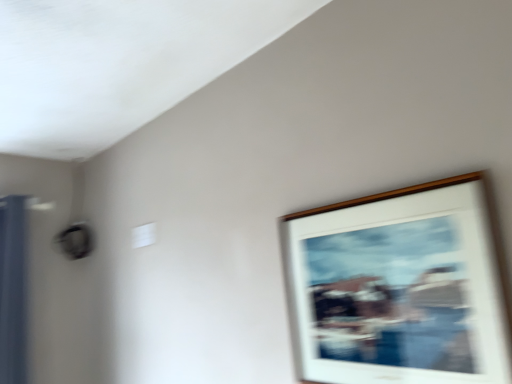
In order to click on white matte picture frame at upper right in this screenshot , I will do `click(400, 286)`.

Based on the photo, in order to face white matte picture frame at upper right, should I rotate leftwards or rightwards?

You should look right and rotate roughly 15.386 degrees.

The image size is (512, 384). Describe the element at coordinates (400, 286) in the screenshot. I see `white matte picture frame at upper right` at that location.

What do you see at coordinates (13, 289) in the screenshot? The image size is (512, 384). I see `blue fabric curtain at left` at bounding box center [13, 289].

Where is `blue fabric curtain at left`? The image size is (512, 384). blue fabric curtain at left is located at coordinates (13, 289).

I want to click on white matte picture frame at upper right, so click(400, 286).

Is blue fabric curtain at left at the left side of white matte picture frame at upper right?

Indeed, blue fabric curtain at left is positioned on the left side of white matte picture frame at upper right.

Which is behind, blue fabric curtain at left or white matte picture frame at upper right?

blue fabric curtain at left.

Considering the positions of point (17, 323) and point (371, 321), is point (17, 323) closer or farther from the camera than point (371, 321)?

Point (17, 323).

From the image's perspective, is blue fabric curtain at left positioned above or below white matte picture frame at upper right?

blue fabric curtain at left is below white matte picture frame at upper right.

From a real-world perspective, does blue fabric curtain at left sit lower than white matte picture frame at upper right?

No, from a real-world perspective, blue fabric curtain at left is not below white matte picture frame at upper right.

Considering the sizes of objects blue fabric curtain at left and white matte picture frame at upper right in the image provided, who is thinner, blue fabric curtain at left or white matte picture frame at upper right?

Thinner between the two is white matte picture frame at upper right.

Does blue fabric curtain at left have a greater height compared to white matte picture frame at upper right?

Yes, blue fabric curtain at left is taller than white matte picture frame at upper right.

Can you confirm if blue fabric curtain at left is bigger than white matte picture frame at upper right?

Yes, blue fabric curtain at left is bigger than white matte picture frame at upper right.

Is white matte picture frame at upper right completely or partially inside blue fabric curtain at left?

No, blue fabric curtain at left does not contain white matte picture frame at upper right.

Would you consider blue fabric curtain at left to be distant from white matte picture frame at upper right?

Yes.

Is blue fabric curtain at left looking in the opposite direction of white matte picture frame at upper right?

No, blue fabric curtain at left is not facing the opposite direction of white matte picture frame at upper right.

Locate an element on the screen. This screenshot has width=512, height=384. curtain behind the white matte picture frame at upper right is located at coordinates (13, 289).

Is white matte picture frame at upper right to the right of blue fabric curtain at left from the viewer's perspective?

Indeed, white matte picture frame at upper right is positioned on the right side of blue fabric curtain at left.

Considering their positions, is white matte picture frame at upper right located in front of or behind blue fabric curtain at left?

white matte picture frame at upper right is in front of blue fabric curtain at left.

Does point (382, 232) come in front of point (10, 283)?

Yes, it is.

From the image's perspective, which is above, white matte picture frame at upper right or blue fabric curtain at left?

From the image's view, white matte picture frame at upper right is above.

From a real-world perspective, is white matte picture frame at upper right located higher than blue fabric curtain at left?

No.

Is white matte picture frame at upper right wider than blue fabric curtain at left?

Incorrect, the width of white matte picture frame at upper right does not surpass that of blue fabric curtain at left.

Who is shorter, white matte picture frame at upper right or blue fabric curtain at left?

Standing shorter between the two is white matte picture frame at upper right.

Considering the relative sizes of white matte picture frame at upper right and blue fabric curtain at left in the image provided, is white matte picture frame at upper right bigger than blue fabric curtain at left?

No.

Which is correct: white matte picture frame at upper right is inside blue fabric curtain at left, or outside of it?

white matte picture frame at upper right is located beyond the bounds of blue fabric curtain at left.

Is white matte picture frame at upper right with blue fabric curtain at left?

No, white matte picture frame at upper right is not with blue fabric curtain at left.

In the scene shown: Is white matte picture frame at upper right facing away from blue fabric curtain at left?

That's not correct — white matte picture frame at upper right is not looking away from blue fabric curtain at left.

What's the angular difference between white matte picture frame at upper right and blue fabric curtain at left's facing directions?

The facing directions of white matte picture frame at upper right and blue fabric curtain at left are 98.3 degrees apart.

This screenshot has height=384, width=512. Identify the location of curtain below the white matte picture frame at upper right (from the image's perspective). (13, 289).

Locate an element on the screen. curtain on the left of white matte picture frame at upper right is located at coordinates (13, 289).

Locate an element on the screen. The image size is (512, 384). picture frame lying above the blue fabric curtain at left (from the image's perspective) is located at coordinates (400, 286).